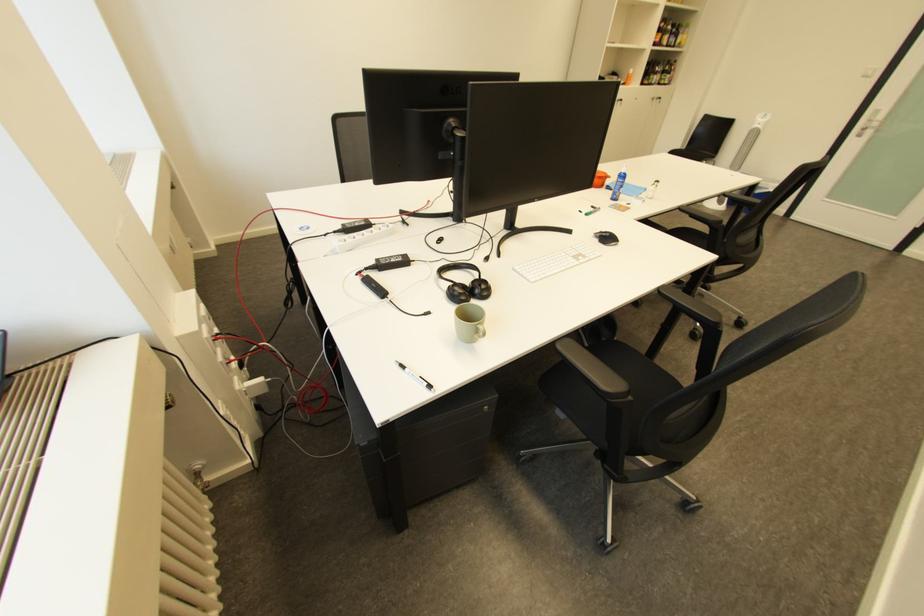
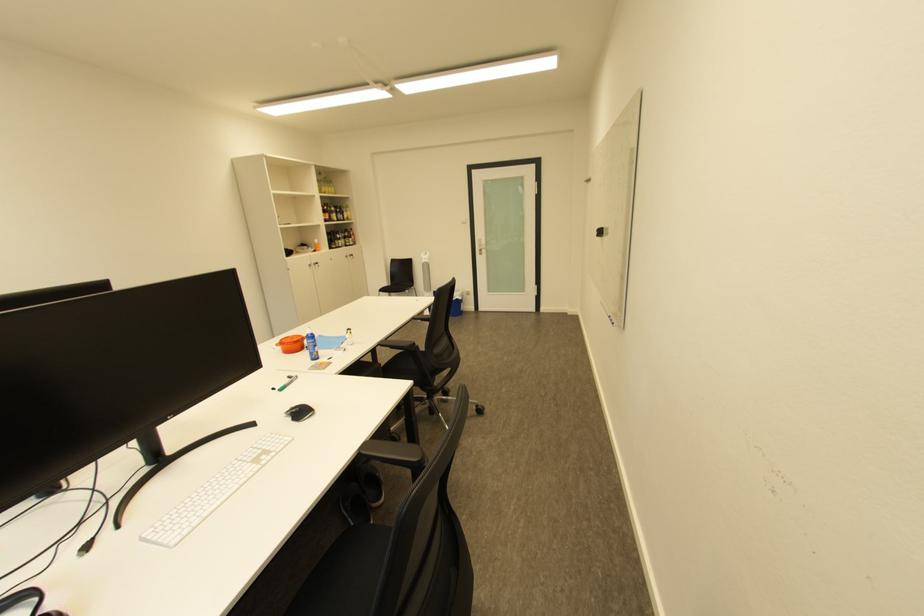
Question: I am providing you with two images of the same scene from different viewpoints. Please identify which objects are invisible in image2.

Choices:
 (A) whiteboard eraser
 (B) brown glass bottle
 (C) blue plastic bottle
 (D) none of these

Answer: (D)